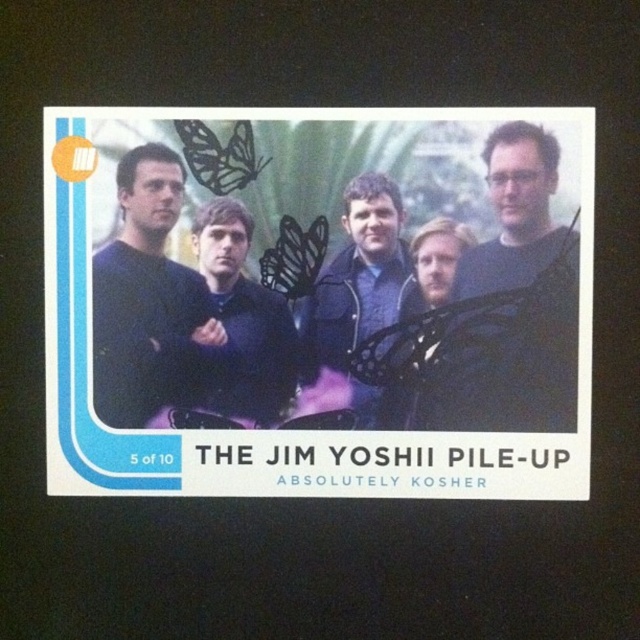
What do you see at coordinates (355, 298) in the screenshot? I see `matte black jacket at center` at bounding box center [355, 298].

Is matte black jacket at center below black matte butterfly at upper left?

Correct, matte black jacket at center is located below black matte butterfly at upper left.

Does point (364, 298) come in front of point (220, 186)?

No, it is behind (220, 186).

At what (x,y) coordinates should I click in order to perform the action: click on matte black jacket at center. Please return your answer as a coordinate pair (x, y). The width and height of the screenshot is (640, 640). Looking at the image, I should click on (355, 298).

Is matte black sweater at left positioned at the back of black matte butterfly at upper left?

No.

In the scene shown: Is matte black sweater at left above black matte butterfly at upper left?

Actually, matte black sweater at left is below black matte butterfly at upper left.

Find the location of `matte black sweater at left`. matte black sweater at left is located at coordinates (145, 296).

This screenshot has width=640, height=640. Find the location of `matte black sweater at left`. matte black sweater at left is located at coordinates (145, 296).

Who is shorter, matte black group at center or black matte butterfly at center?

black matte butterfly at center is shorter.

Between point (564, 310) and point (292, 243), which one is positioned behind?

Point (292, 243)

Describe the element at coordinates (321, 305) in the screenshot. This screenshot has height=640, width=640. I see `matte black group at center` at that location.

Identify the location of matte black group at center. The width and height of the screenshot is (640, 640). (321, 305).